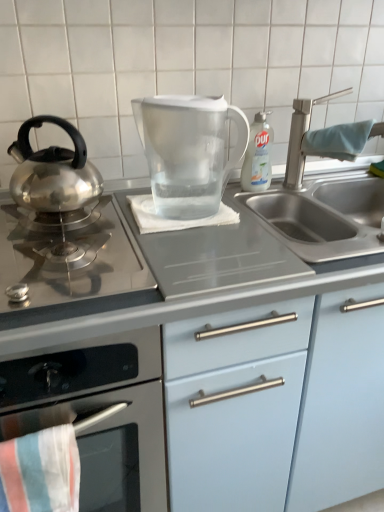
This screenshot has height=512, width=384. I want to click on vacant area in front of white cloth at center, the 2th beach towel in the top-to-bottom sequence, so click(202, 252).